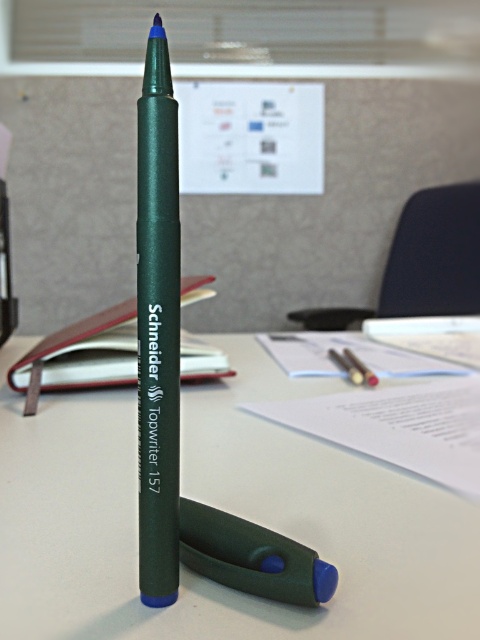
You are organizing a desk and need to place the green rubberized pen at center onto the white matte table at center. Can you do this without moving any other objects?

The white matte table at center is already above the green rubberized pen at center, so you can place the green rubberized pen at center onto the white matte table at center without moving other objects.

In the scene shown: You are standing in front of the desk and want to place a small object on the white matte table at center. Where exactly should you place it?

The white matte table at center is located at the 2D coordinates point (223,509), so you should place the small object there.

You are organizing a desk and need to place a small 10 cm wide object between the white matte table at center and the green rubberized pen at center. Is there enough space between them to fit the object?

The white matte table at center and green rubberized pen at center are 23.42 centimeters apart from each other. Since the object is only 10 cm wide, there is sufficient space to fit it between them.